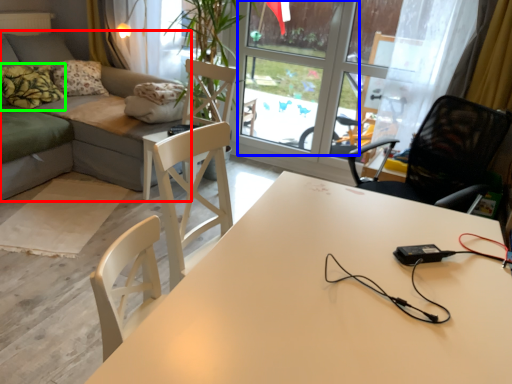
Question: Which object is the closest to the studio couch (highlighted by a red box)? Choose among these: window screen (highlighted by a blue box) or pillow (highlighted by a green box).

Choices:
 (A) window screen
 (B) pillow

Answer: (B)